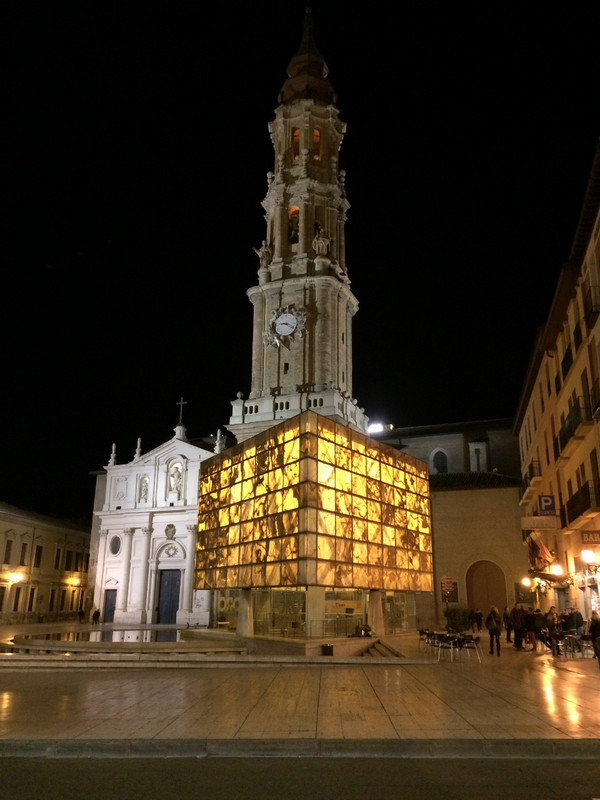
Identify the location of tales and chairs. (445, 640).